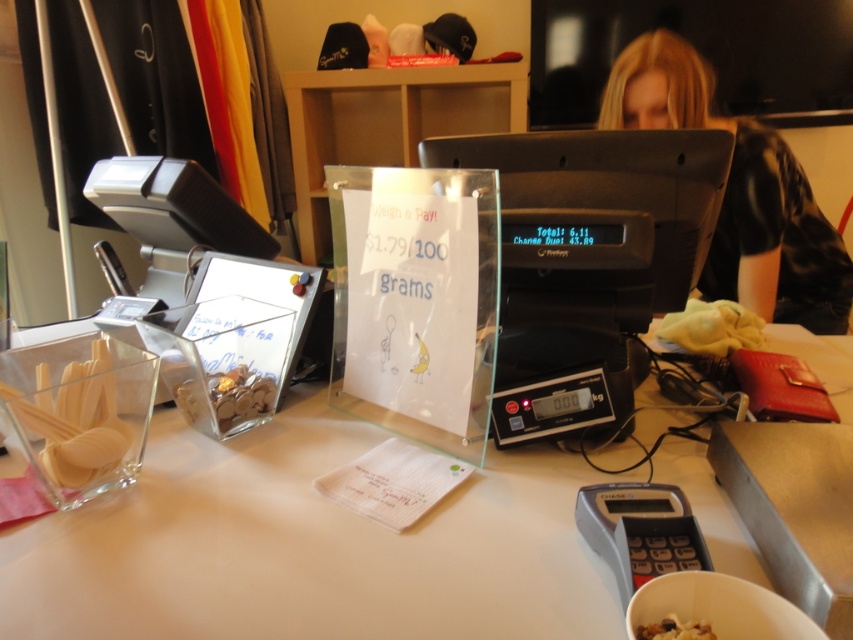
Can you confirm if black plastic scale at center is positioned above black plastic scale at lower right?

Yes, black plastic scale at center is above black plastic scale at lower right.

Does black plastic scale at center appear on the left side of black plastic scale at lower right?

In fact, black plastic scale at center is to the right of black plastic scale at lower right.

Does point (569, 326) come behind point (647, 564)?

That is True.

I want to click on black plastic scale at center, so click(592, 241).

Is white matte table at center shorter than blonde hair at upper right?

Yes.

Between white matte table at center and blonde hair at upper right, which one is positioned higher?

blonde hair at upper right is above.

Which is in front, point (548, 456) or point (838, 300)?

Point (548, 456) is more forward.

Image resolution: width=853 pixels, height=640 pixels. Identify the location of white matte table at center. (308, 545).

Is clear plastic container at left taller than translucent plastic bag of nuts at center?

Indeed, clear plastic container at left has a greater height compared to translucent plastic bag of nuts at center.

In order to click on clear plastic container at left in this screenshot , I will do `click(74, 419)`.